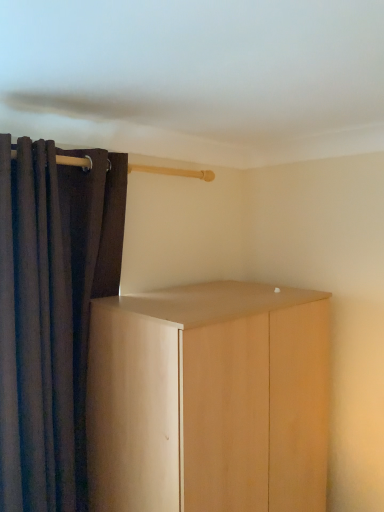
Question: Considering the relative sizes of light wood cupboard at center and dark fabric curtain at left in the image provided, is light wood cupboard at center wider than dark fabric curtain at left?

Choices:
 (A) no
 (B) yes

Answer: (B)

Question: Is light wood cupboard at center at the right side of dark fabric curtain at left?

Choices:
 (A) yes
 (B) no

Answer: (A)

Question: Is light wood cupboard at center positioned in front of dark fabric curtain at left?

Choices:
 (A) no
 (B) yes

Answer: (B)

Question: Is light wood cupboard at center turned away from dark fabric curtain at left?

Choices:
 (A) no
 (B) yes

Answer: (A)

Question: Does light wood cupboard at center have a larger size compared to dark fabric curtain at left?

Choices:
 (A) yes
 (B) no

Answer: (A)

Question: Would you say light wood cupboard at center contains dark fabric curtain at left?

Choices:
 (A) yes
 (B) no

Answer: (B)

Question: Is dark fabric curtain at left turned away from light wood cupboard at center?

Choices:
 (A) yes
 (B) no

Answer: (B)

Question: From the image's perspective, is dark fabric curtain at left on top of light wood cupboard at center?

Choices:
 (A) no
 (B) yes

Answer: (B)

Question: From the image's perspective, is dark fabric curtain at left located beneath light wood cupboard at center?

Choices:
 (A) yes
 (B) no

Answer: (B)

Question: Can you confirm if dark fabric curtain at left is smaller than light wood cupboard at center?

Choices:
 (A) yes
 (B) no

Answer: (A)

Question: Considering the relative sizes of dark fabric curtain at left and light wood cupboard at center in the image provided, is dark fabric curtain at left taller than light wood cupboard at center?

Choices:
 (A) no
 (B) yes

Answer: (B)

Question: Considering the relative sizes of dark fabric curtain at left and light wood cupboard at center in the image provided, is dark fabric curtain at left bigger than light wood cupboard at center?

Choices:
 (A) no
 (B) yes

Answer: (A)

Question: Considering the positions of dark fabric curtain at left and light wood cupboard at center in the image, is dark fabric curtain at left taller or shorter than light wood cupboard at center?

Choices:
 (A) short
 (B) tall

Answer: (B)